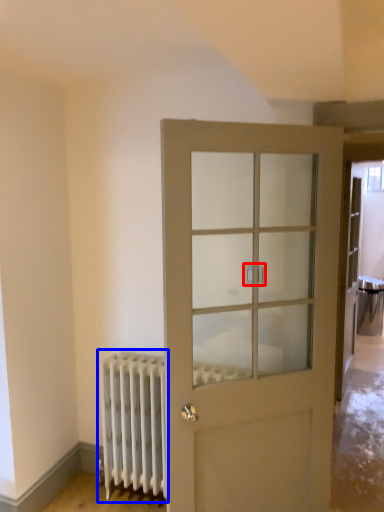
Question: Which object appears closest to the camera in this image, door handle (highlighted by a red box) or radiator (highlighted by a blue box)?

Choices:
 (A) door handle
 (B) radiator

Answer: (A)